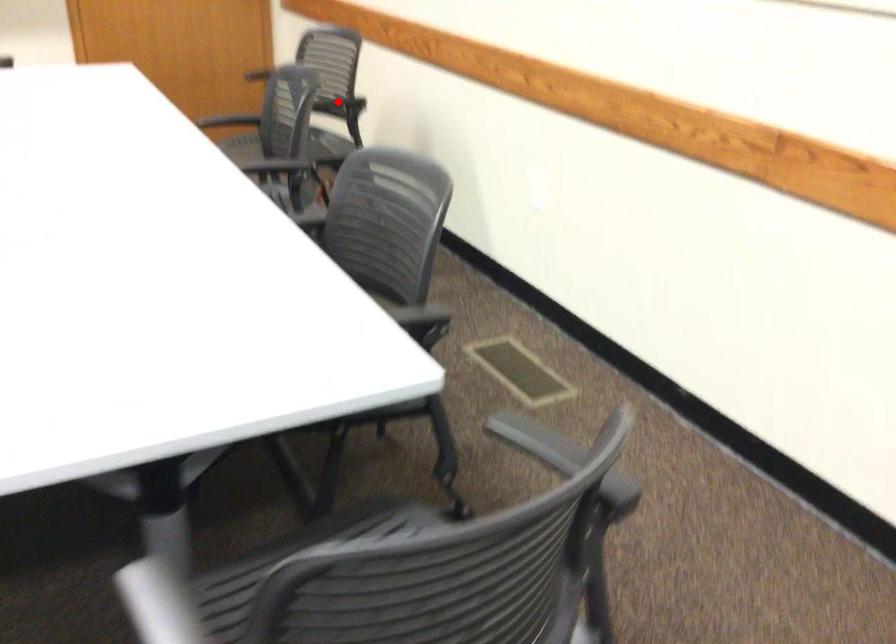
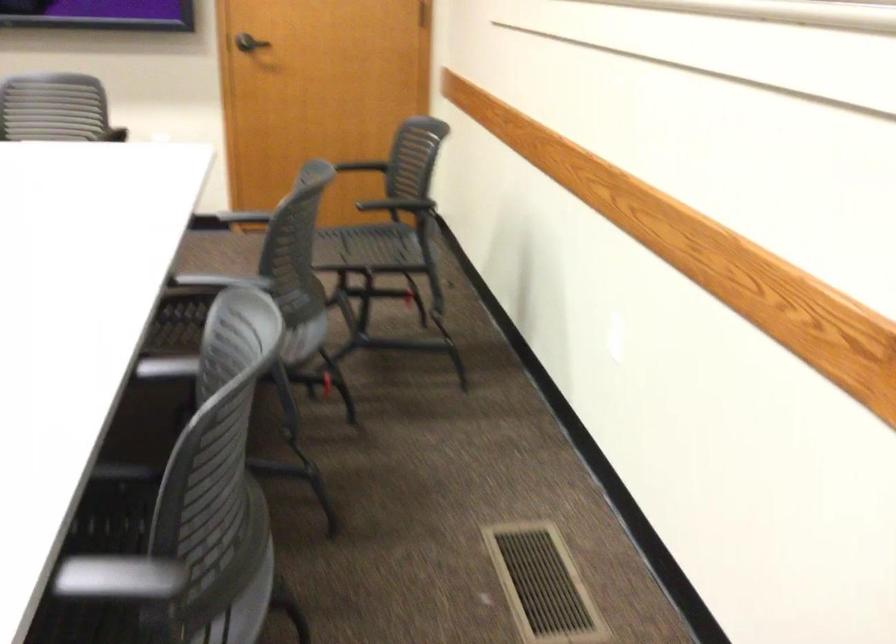
Question: I am providing you with two images of the same scene from different viewpoints. In image1, a red point is highlighted. Considering the same 3D point in image2, which of the following is correct?

Choices:
 (A) It is closer
 (B) It is farther

Answer: (A)